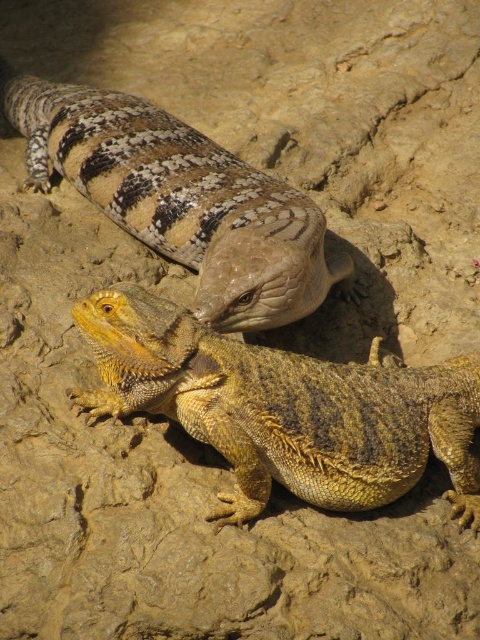
Question: Which of the following is the closest to the observer?

Choices:
 (A) yellow scaly lizard at lower left
 (B) speckled sandstone lizard at upper center

Answer: (A)

Question: Is the position of yellow scaly lizard at lower left more distant than that of speckled sandstone lizard at upper center?

Choices:
 (A) yes
 (B) no

Answer: (B)

Question: Which point is farther to the camera?

Choices:
 (A) yellow scaly lizard at lower left
 (B) speckled sandstone lizard at upper center

Answer: (B)

Question: Can you confirm if yellow scaly lizard at lower left is wider than speckled sandstone lizard at upper center?

Choices:
 (A) no
 (B) yes

Answer: (A)

Question: Is yellow scaly lizard at lower left below speckled sandstone lizard at upper center?

Choices:
 (A) yes
 (B) no

Answer: (A)

Question: Which point is closer to the camera taking this photo?

Choices:
 (A) (154, 241)
 (B) (399, 432)

Answer: (B)